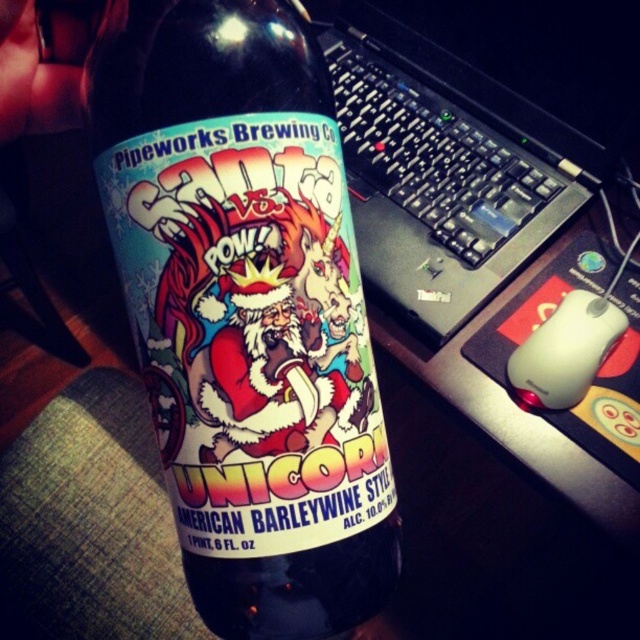
Question: Is black plastic keyboard at upper center wider than white matte mouse at lower right?

Choices:
 (A) no
 (B) yes

Answer: (B)

Question: Which of the following is the farthest from the observer?

Choices:
 (A) (586, 294)
 (B) (428, 83)

Answer: (B)

Question: Which point is farther from the camera taking this photo?

Choices:
 (A) (388, 83)
 (B) (566, 332)

Answer: (A)

Question: Which object is closer to the camera taking this photo?

Choices:
 (A) white matte mouse at lower right
 (B) glossy glass bottle at center

Answer: (B)

Question: Is black plastic keyboard at upper center wider than white matte mouse at lower right?

Choices:
 (A) yes
 (B) no

Answer: (A)

Question: Does glossy glass bottle at center come in front of black plastic keyboard at upper center?

Choices:
 (A) yes
 (B) no

Answer: (A)